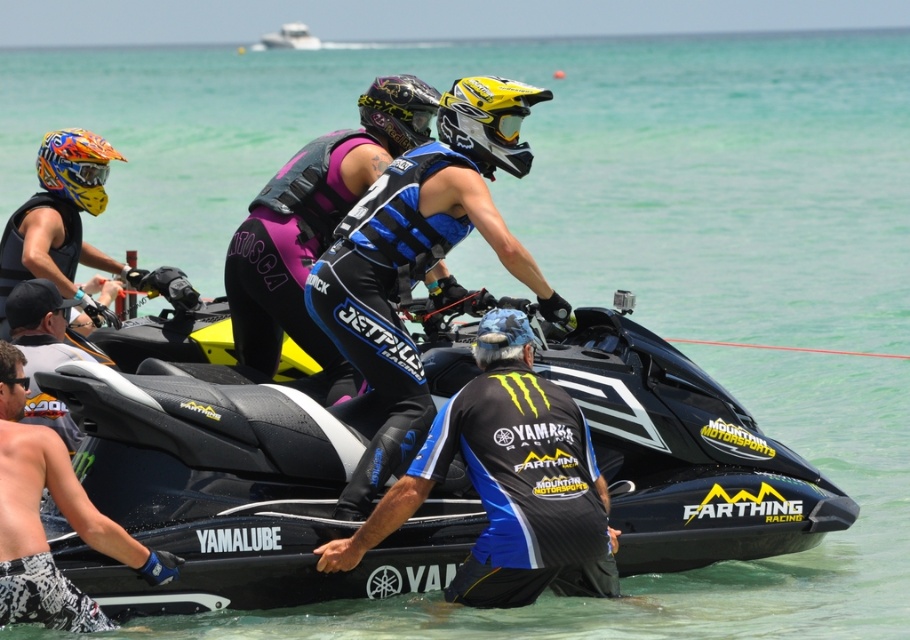
Question: Which is farther from the black mesh shirt at center?

Choices:
 (A) white glossy boat at upper center
 (B) shiny blue and black wetsuit at center
 (C) brushed metal goggles at upper left

Answer: (A)

Question: Which object is positioned farthest from the matte black helmet at left?

Choices:
 (A) matte black wetsuit at center
 (B) black matte jet ski at center

Answer: (B)

Question: Which of these objects is positioned closest to the black matte wetsuit at center?

Choices:
 (A) matte black wetsuit at center
 (B) white glossy boat at upper center
 (C) black matte goggles at upper left
 (D) brushed metal goggles at upper left

Answer: (C)

Question: Does matte black helmet at left appear on the right side of brushed metal goggles at upper left?

Choices:
 (A) yes
 (B) no

Answer: (B)

Question: Is black matte jet ski at center to the right of black matte goggles at upper left from the viewer's perspective?

Choices:
 (A) yes
 (B) no

Answer: (A)

Question: Can you confirm if white glossy boat at upper center is positioned to the right of brushed metal goggles at upper left?

Choices:
 (A) no
 (B) yes

Answer: (A)